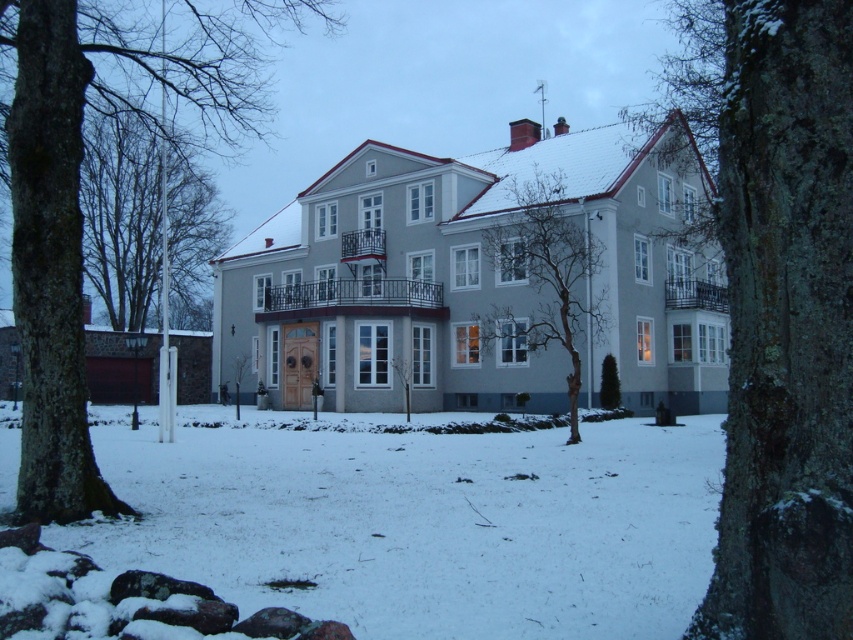
You are standing in front of the residential building and notice two trees. The green mossy bark tree at center and the bare branches at left. Which tree is closer to the ground?

The green mossy bark tree at center is closer to the ground than the bare branches at left because it is positioned below it.

You are standing in front of the residential building and notice two trees in the scene. Which tree, the green mossy bark tree at center or the bare branches at left, is shorter?

The green mossy bark tree at center is shorter than the bare branches at left.